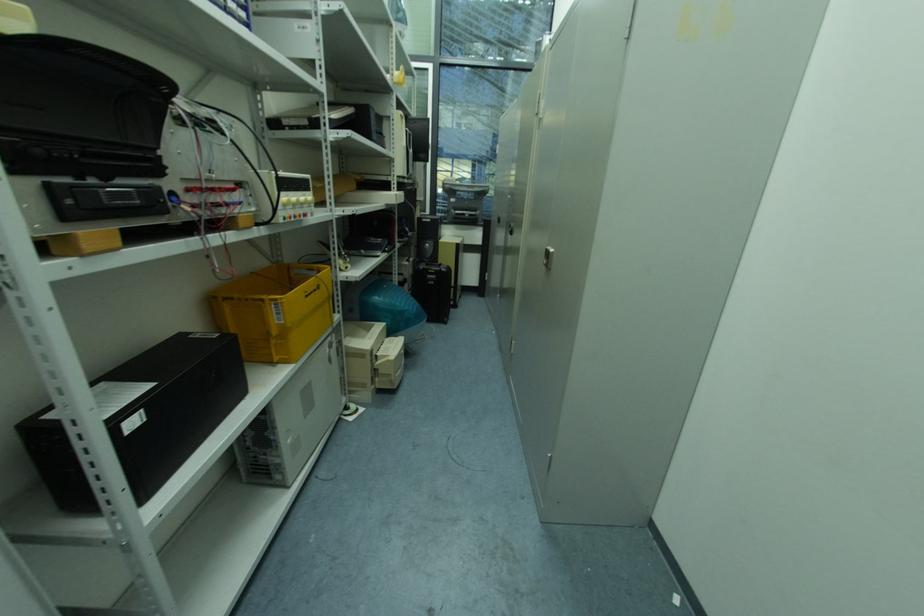
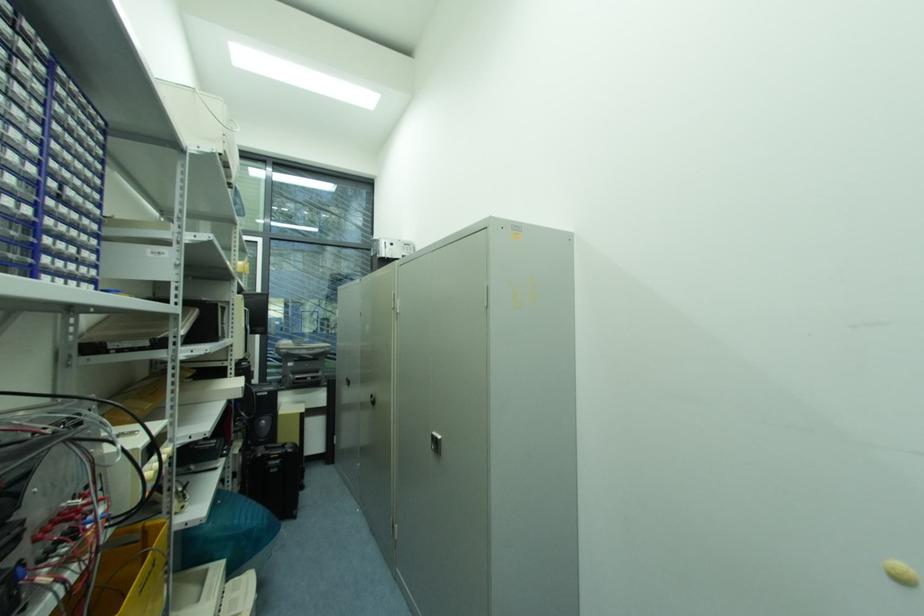
The images are taken continuously from a first-person perspective. In which direction is your viewpoint rotating?

The camera's rotation is toward right-up.